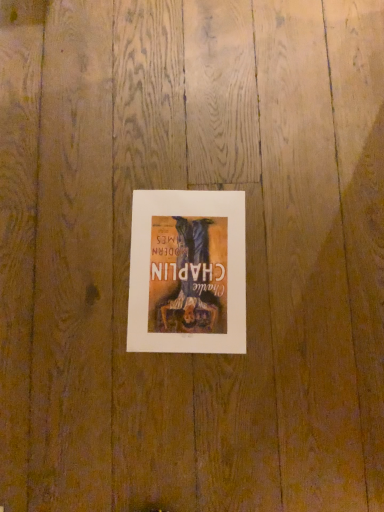
In order to click on white paper at center in this screenshot , I will do `click(187, 272)`.

Describe the element at coordinates (187, 272) in the screenshot. This screenshot has width=384, height=512. I see `white paper at center` at that location.

Where is `white paper at center`? This screenshot has width=384, height=512. white paper at center is located at coordinates (187, 272).